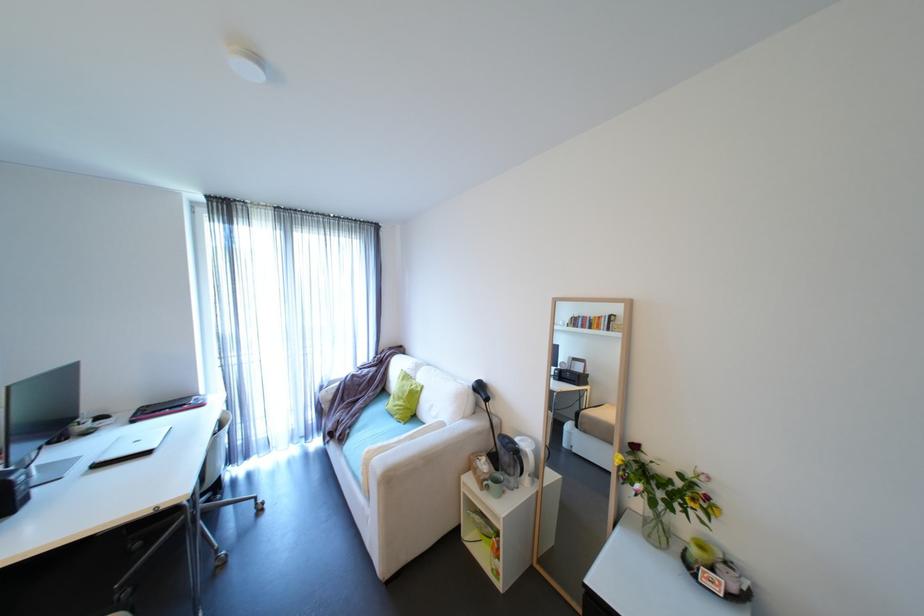
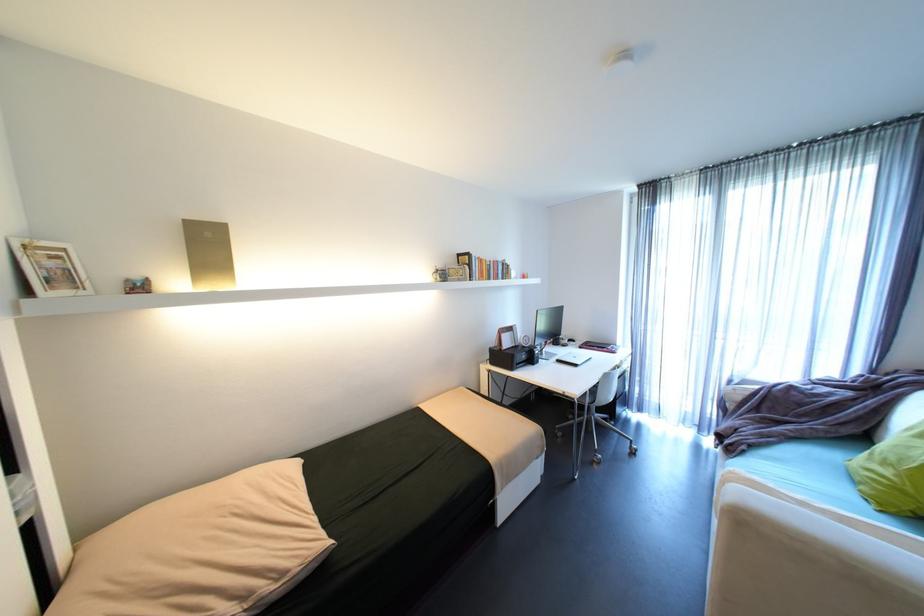
In the second image, find the point that corresponds to pixel 91 475 in the first image.

(562, 363)